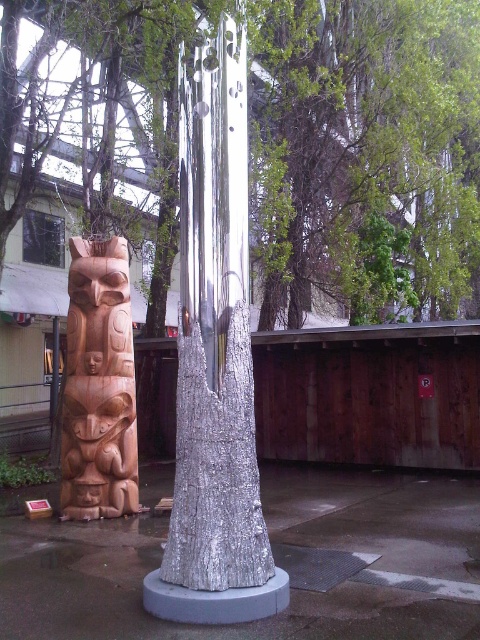
Question: Which of these objects is positioned farthest from the wooden totem pole at left?

Choices:
 (A) shiny metallic tree trunk at center
 (B) wooden totem pole at center
 (C) shiny metallic tree at center

Answer: (B)

Question: Is shiny metallic tree at center bigger than shiny metallic tree trunk at center?

Choices:
 (A) yes
 (B) no

Answer: (A)

Question: Which of the following is the farthest from the observer?

Choices:
 (A) wooden totem pole at center
 (B) shiny metallic tree trunk at center

Answer: (A)

Question: Can you confirm if shiny metallic tree at center is positioned above shiny metallic tree trunk at center?

Choices:
 (A) no
 (B) yes

Answer: (B)

Question: Which object appears closest to the camera in this image?

Choices:
 (A) shiny metallic tree at center
 (B) wooden totem pole at center
 (C) wooden totem pole at left

Answer: (A)

Question: Is shiny metallic tree at center bigger than shiny metallic tree trunk at center?

Choices:
 (A) yes
 (B) no

Answer: (A)